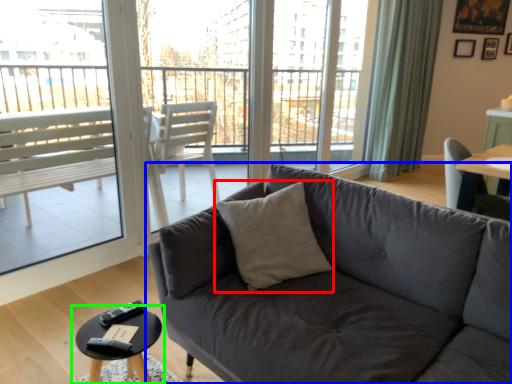
Question: Considering the real-world distances, which object is closest to throw pillow (highlighted by a red box)? studio couch (highlighted by a blue box) or coffee table (highlighted by a green box).

Choices:
 (A) studio couch
 (B) coffee table

Answer: (A)